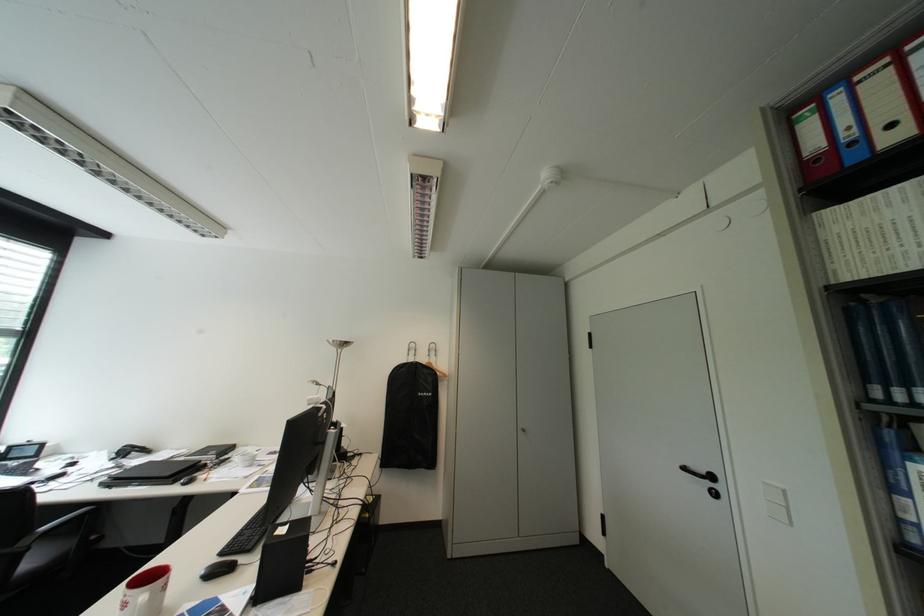
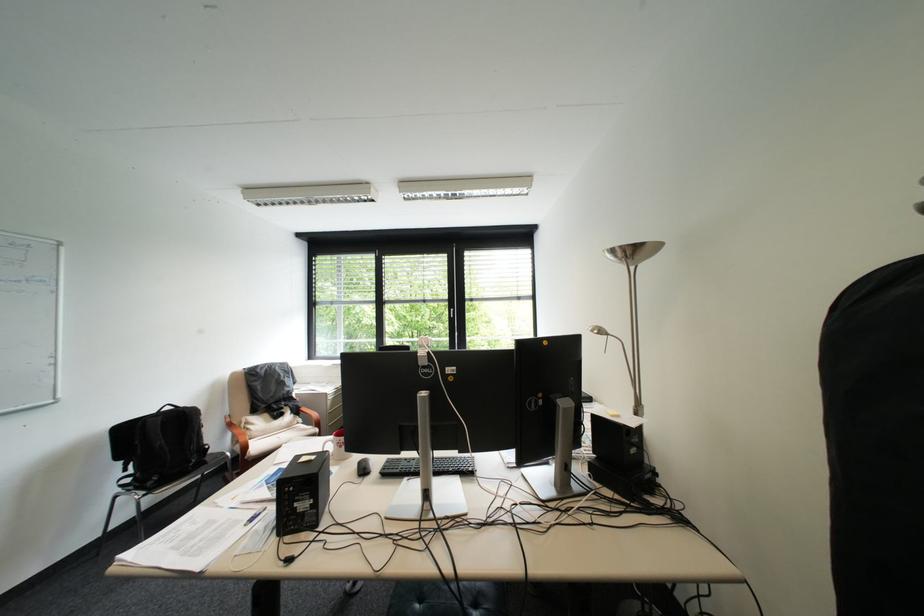
In the second image, find the point that corresponds to the point at 346,341 in the first image.

(625, 252)